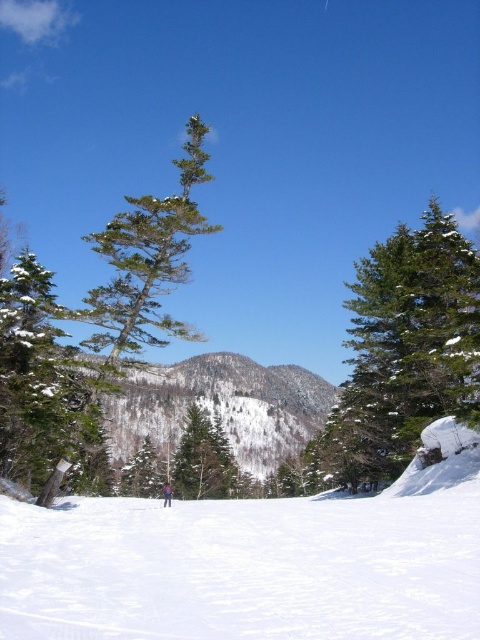
Does green textured pine tree at right appear under green matte tree at center?

No, green textured pine tree at right is not below green matte tree at center.

Can you confirm if green textured pine tree at right is thinner than green matte tree at center?

Yes, green textured pine tree at right is thinner than green matte tree at center.

Is point (474, 346) less distant than point (195, 476)?

Yes, it is in front of point (195, 476).

Locate an element on the screen. This screenshot has width=480, height=640. green textured pine tree at right is located at coordinates (405, 349).

Does point (31, 344) come in front of point (193, 492)?

Yes, point (31, 344) is in front of point (193, 492).

Is green matte tree at left wider than green matte tree at center?

Indeed, green matte tree at left has a greater width compared to green matte tree at center.

Find the location of a particular element. The width and height of the screenshot is (480, 640). green matte tree at left is located at coordinates (44, 388).

At what (x,y) coordinates should I click in order to perform the action: click on green matte tree at left. Please return your answer as a coordinate pair (x, y). The width and height of the screenshot is (480, 640). Looking at the image, I should click on point(44,388).

Who is shorter, white snow ski slope at lower center or green textured pine tree at right?

white snow ski slope at lower center is shorter.

You are a GUI agent. You are given a task and a screenshot of the screen. Output one action in this format:
    pyautogui.click(x=<x>, y=<y>)
    Task: Click on the white snow ski slope at lower center
    
    Given the screenshot: What is the action you would take?
    pyautogui.click(x=242, y=570)